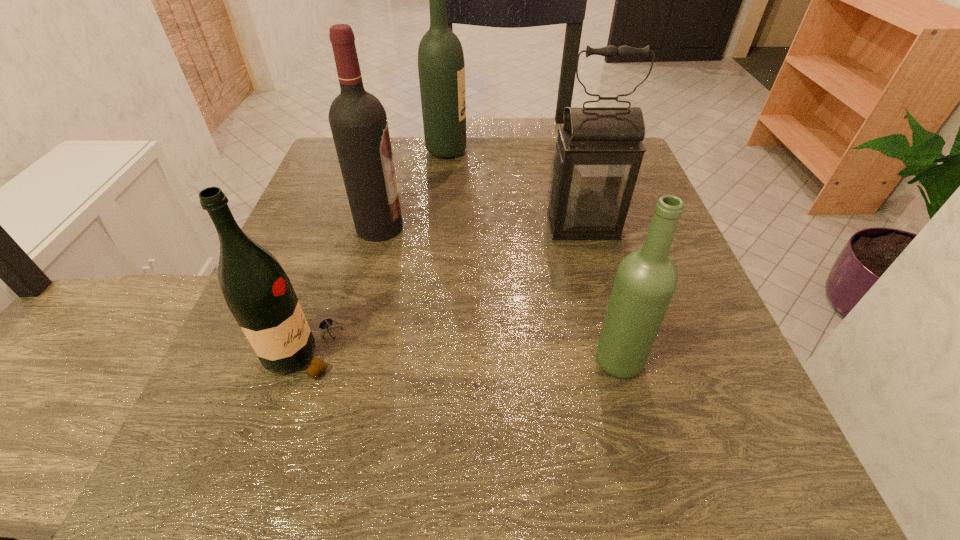
You are a GUI agent. You are given a task and a screenshot of the screen. Output one action in this format:
    pyautogui.click(x=<x>, y=<y>)
    Task: Click on the object that ranks as the fourth closest to the second wine bottle from right to left
    The width and height of the screenshot is (960, 540).
    Given the screenshot: What is the action you would take?
    pyautogui.click(x=646, y=279)

In order to click on object that ranks as the third closest to the rightmost wine bottle in this screenshot , I will do `click(358, 121)`.

I want to click on the closest wine bottle to the lantern, so click(646, 279).

This screenshot has width=960, height=540. Identify the location of wine bottle that stands as the third closest to the lantern. (358, 121).

Locate an element on the screen. The height and width of the screenshot is (540, 960). vacant point that satisfies the following two spatial constraints: 1. on the labeled side of the rightmost wine bottle; 2. on the left side of the third object from right to left is located at coordinates (424, 360).

Where is `vacant point that satisfies the following two spatial constraints: 1. on the labeled side of the rightmost wine bottle; 2. on the right side of the third object from left to right`? This screenshot has height=540, width=960. vacant point that satisfies the following two spatial constraints: 1. on the labeled side of the rightmost wine bottle; 2. on the right side of the third object from left to right is located at coordinates (424, 360).

Locate an element on the screen. This screenshot has width=960, height=540. vacant point that satisfies the following two spatial constraints: 1. on the front-facing side of the lantern; 2. on the label of the second farthest wine bottle is located at coordinates (583, 227).

Locate an element on the screen. Image resolution: width=960 pixels, height=540 pixels. free point that satisfies the following two spatial constraints: 1. on the front-facing side of the lantern; 2. on the label of the third nearest wine bottle is located at coordinates (583, 227).

Find the location of a particular element. The width and height of the screenshot is (960, 540). free space that satisfies the following two spatial constraints: 1. on the back side of the rightmost wine bottle; 2. on the label of the third nearest wine bottle is located at coordinates (583, 227).